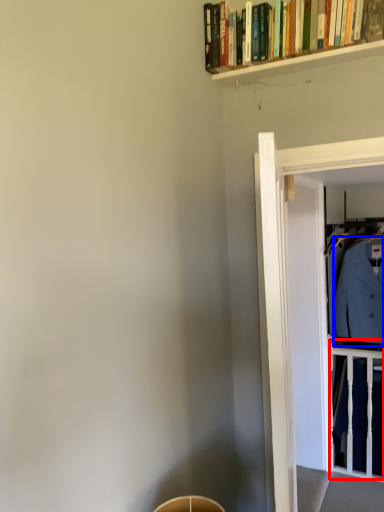
Question: Which object appears farthest to the camera in this image, balustrade (highlighted by a red box) or dress shirt (highlighted by a blue box)?

Choices:
 (A) balustrade
 (B) dress shirt

Answer: (A)